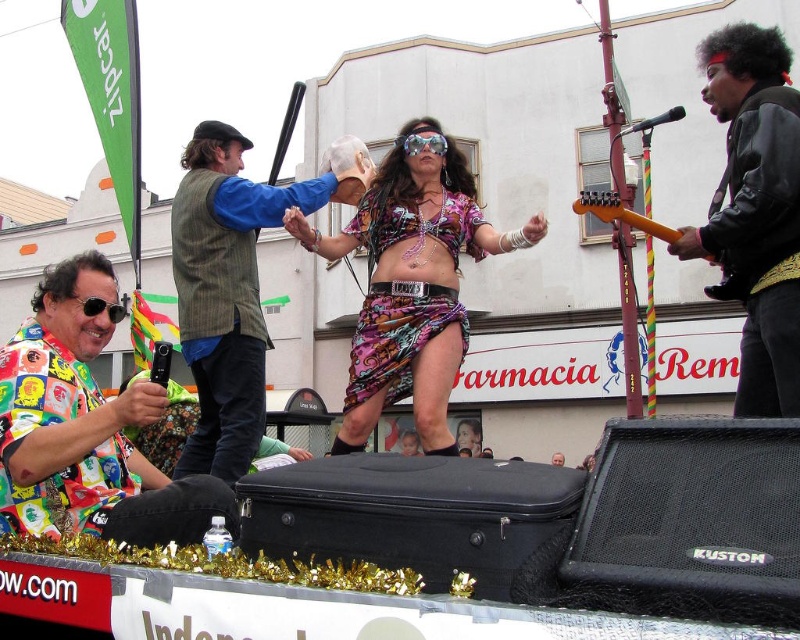
You are a photographer trying to capture both the colorful patchwork shirt at lower left and the printed fabric skirt at center in a single shot. Based on their positions, which one will appear closer to the camera in your photo?

The colorful patchwork shirt at lower left will appear closer to the camera because it is in front of the printed fabric skirt at center.

You are a photographer standing at the center of the image. You need to capture a photo that includes both the Farmacia Rem sign in the background and the colorful patchwork shirt at lower left. Based on their positions, will the shirt be visible in the frame if you focus on the Farmacia Rem sign?

The shirt will be visible because the Farmacia Rem sign is in the background and the colorful patchwork shirt at lower left is positioned at point [86,426], which is within the frame when focusing on the background sign.

You are a photographer trying to capture the colorful patchwork shirt at lower left and the printed fabric skirt at center in the same frame. Based on their positions, which object should you position closer to the left side of your camera viewfinder?

The colorful patchwork shirt at lower left should be positioned closer to the left side of the camera viewfinder since it is located to the left of the printed fabric skirt at center.